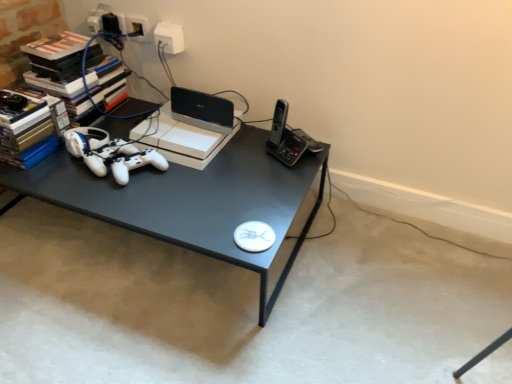
Identify the location of vacant space in front of white matte game controller at center. (140, 211).